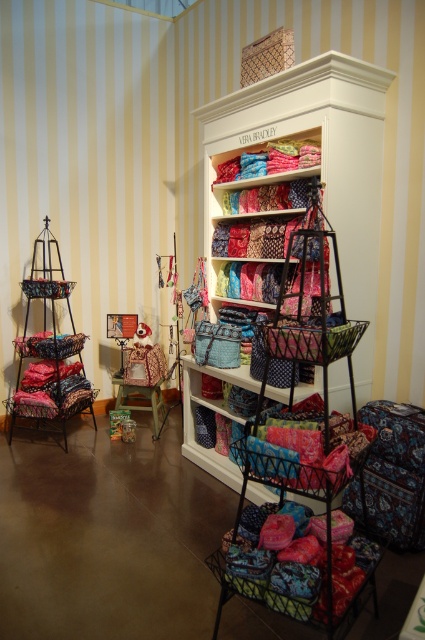
You are a customer in the store and want to pick up both the metallic wire basket at left and the wooden stool at center. Which object should you reach for first to avoid obstructing the other?

You should reach for the metallic wire basket at left first because it is in front of the wooden stool at center. Picking up the basket first will allow you to move it out of the way, making the stool more accessible without obstruction.